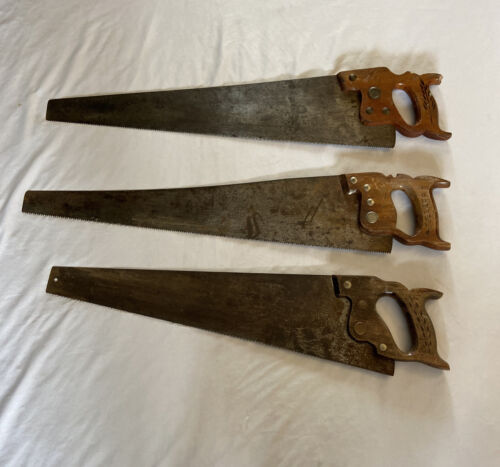
This screenshot has width=500, height=467. Find the location of `dull brown handle`. dull brown handle is located at coordinates (423, 353).